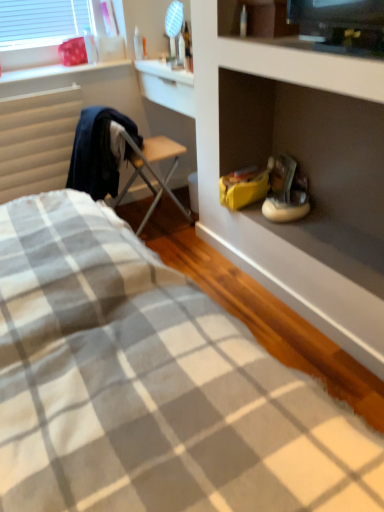
Where is `free location above beige fabric radiator at left (from a real-world perspective)`? free location above beige fabric radiator at left (from a real-world perspective) is located at coordinates (29, 89).